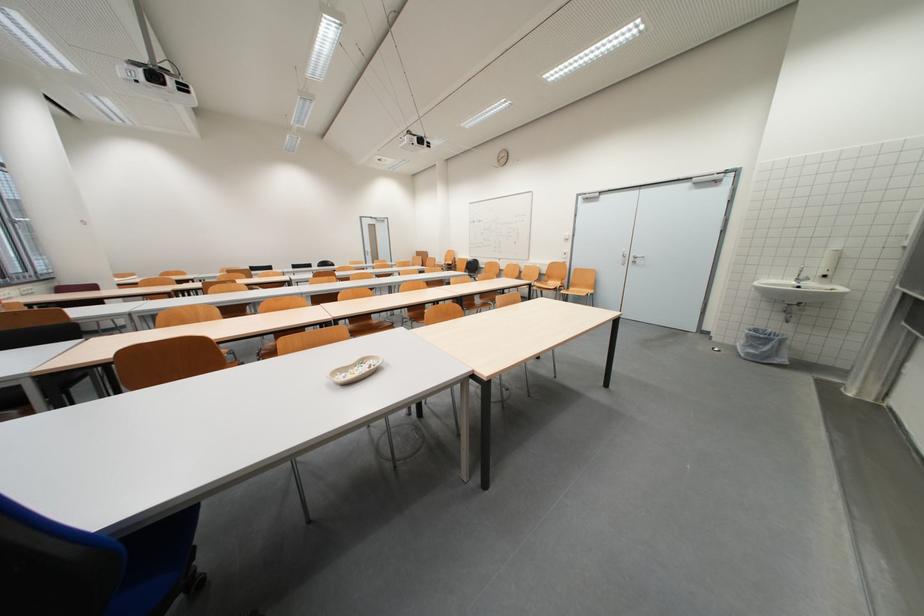
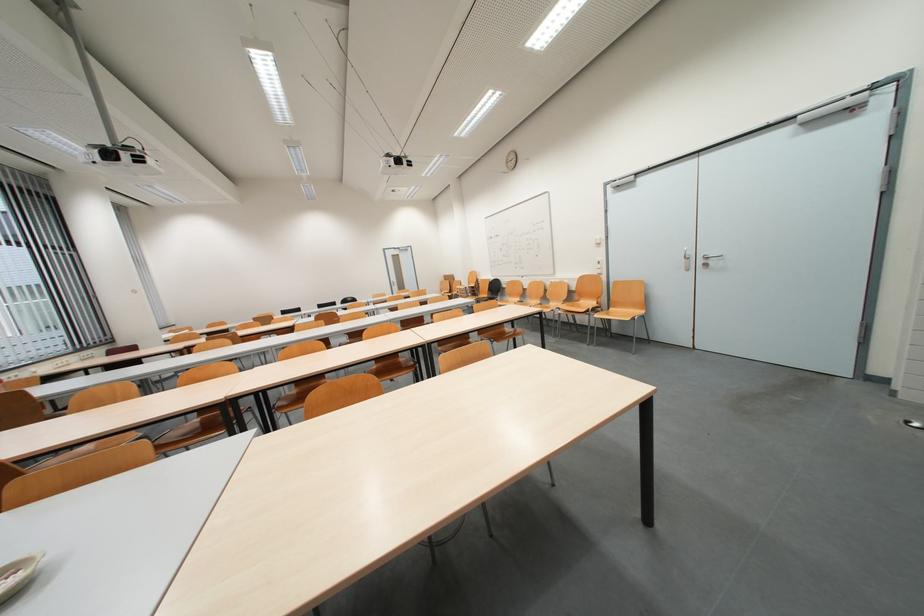
Find the pixel in the second image that matches (x=280, y=342) in the first image.

(201, 419)